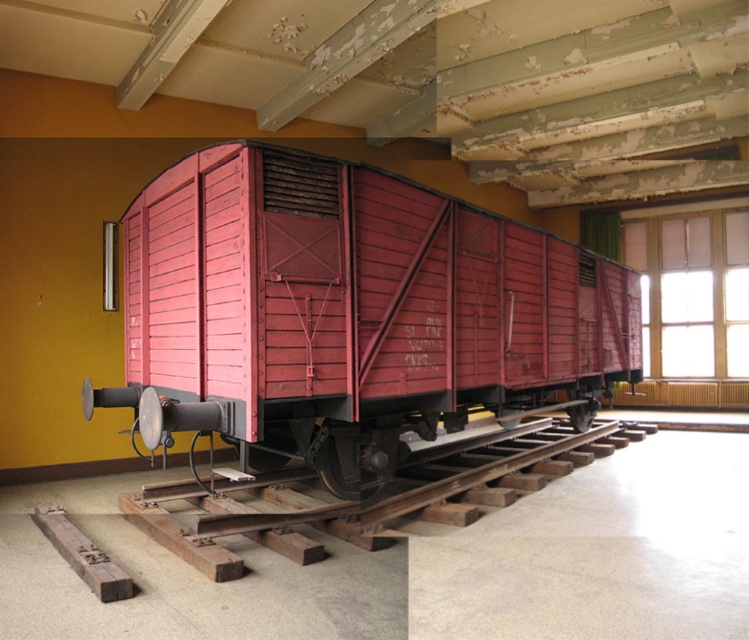
Based on the scene description, which object is positioned to the left of the other between the matte wood train car at center and the wooden at center?

The matte wood train car at center is positioned to the left of the wooden at center.

You are an interior designer planning to move the matte wood train car at center and the wooden at center to a new location. The new space has limited width. Which object should you move first to ensure both can fit through the narrow doorway?

The wooden at center should be moved first because it is smaller in size compared to the matte wood train car at center, allowing it to pass through the narrow doorway more easily before moving the larger train car.

You are standing in the museum and want to find the exact location of the matte wood train car at center. According to the coordinates provided, where is it positioned?

The matte wood train car at center is positioned at point (351,310).